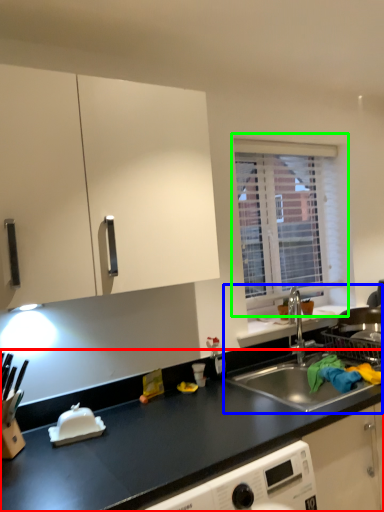
Question: Considering the real-world distances, which object is farthest from countertop (highlighted by a red box)? sink (highlighted by a blue box) or window (highlighted by a green box)?

Choices:
 (A) sink
 (B) window

Answer: (B)